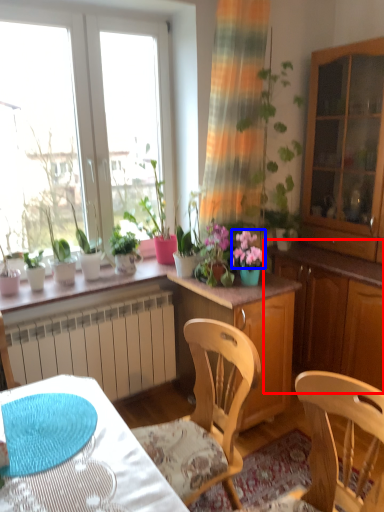
Question: Which object is further to the camera taking this photo, dresser (highlighted by a red box) or flower (highlighted by a blue box)?

Choices:
 (A) dresser
 (B) flower

Answer: (B)